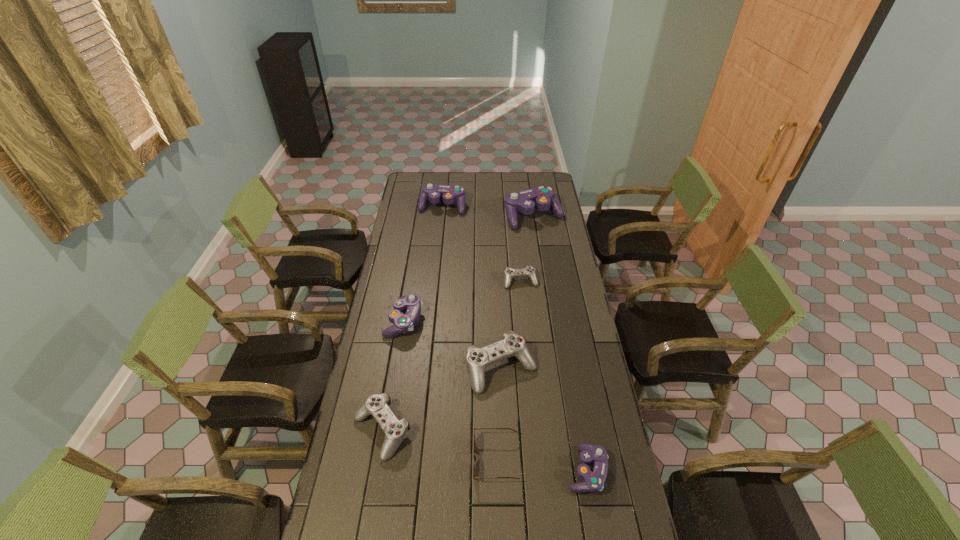
This screenshot has width=960, height=540. Find the location of `the smallest purple control`. the smallest purple control is located at coordinates (593, 481).

Image resolution: width=960 pixels, height=540 pixels. I want to click on brown spectacles, so click(x=474, y=457).

Where is `the smallest white control`? Image resolution: width=960 pixels, height=540 pixels. the smallest white control is located at coordinates click(529, 271).

Find the location of a particular element. Image resolution: width=960 pixels, height=540 pixels. the third farthest control is located at coordinates (529, 271).

Find the location of a particular element. This screenshot has height=540, width=960. vacant space situated on the left of the biggest purple control is located at coordinates (452, 217).

Image resolution: width=960 pixels, height=540 pixels. I want to click on vacant area situated 0.120m on the back of the seventh shortest object, so click(x=444, y=187).

This screenshot has width=960, height=540. In order to click on vacant space situated on the front of the fourth farthest control in this screenshot , I will do `click(396, 370)`.

You are a GUI agent. You are given a task and a screenshot of the screen. Output one action in this format:
    pyautogui.click(x=<x>, y=<y>)
    Task: Click on the vacant area situated on the right of the biggest white control
    The image size is (960, 540).
    Given the screenshot: What is the action you would take?
    pyautogui.click(x=590, y=369)

Find the location of a particular element. This screenshot has width=960, height=540. blank space located on the front of the second biggest white control is located at coordinates (364, 532).

Where is `vacant region located on the left of the smallest purple control`? Image resolution: width=960 pixels, height=540 pixels. vacant region located on the left of the smallest purple control is located at coordinates (470, 471).